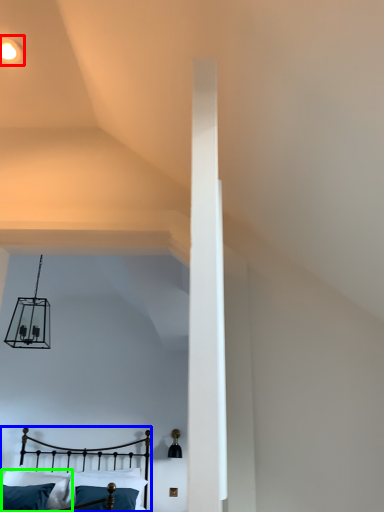
Question: Estimate the real-world distances between objects in this image. Which object is closer to light fixture (highlighted by a red box), bed (highlighted by a blue box) or pillow (highlighted by a green box)?

Choices:
 (A) bed
 (B) pillow

Answer: (B)